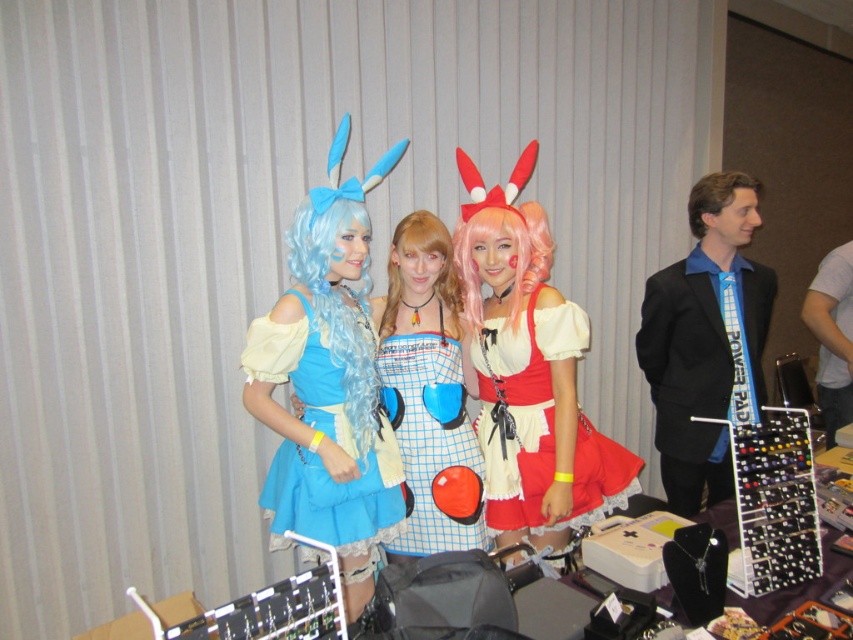
You are a photographer who needs to arrange the light brown silky wig at center and the brown synthetic wig at right for a photo shoot. According to the scene, which wig should be placed to the left of the other?

The light brown silky wig at center should be placed to the left of the brown synthetic wig at right because it is positioned on the left side of the brown synthetic wig at right.

You are a photographer at the event and need to position the two people wearing the checkered fabric dress at center and the red satin dress at center so that their dresses don not overlap in the photo. Which dress should be placed closer to the camera to ensure there is enough space between them?

The checkered fabric dress at center has a lesser width compared to the red satin dress at center. To prevent overlapping, the wider red satin dress at center should be placed closer to the camera, allowing more space for its larger size.